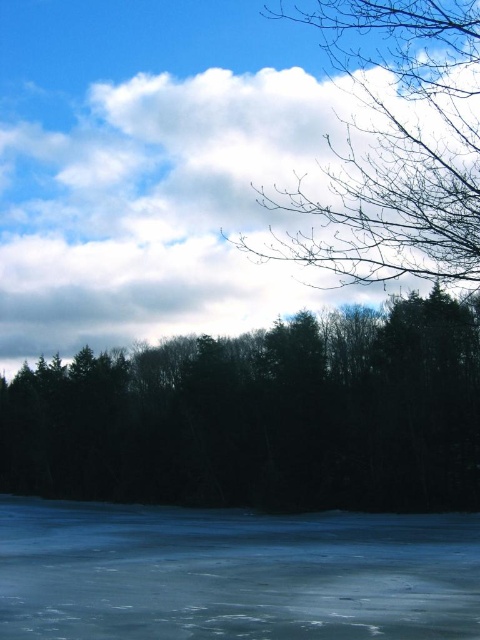
Based on the photo, you are an ice skater standing on the transparent ice at bottom. You want to move towards the dark green textured trees at center. Which direction should you skate to reach them?

The dark green textured trees at center are positioned on the left side of transparent ice at bottom, so you should skate to the left to reach them.

You are an artist sketching the winter scene. You need to decide which area to focus on first based on their sizes. Which object should you draw first, the dark green textured trees at center or the bare branches at upper right?

The dark green textured trees at center should be drawn first because their width is larger than the bare branches at upper right, making them a more prominent feature in the scene.

You are standing in the winter landscape and want to walk from the point at coordinates point (4, 536) to the point at coordinates point (383, 192). Since the ice surface is smooth but slightly textured, will you need to take extra caution while walking towards the latter point?

Point (4, 536) is further to the camera than point (383, 192), so you are starting closer to your current position and moving towards a point that is farther away. Since the ice surface is smooth but slightly textured, you should still take caution as the ice might be slippery despite the texture.